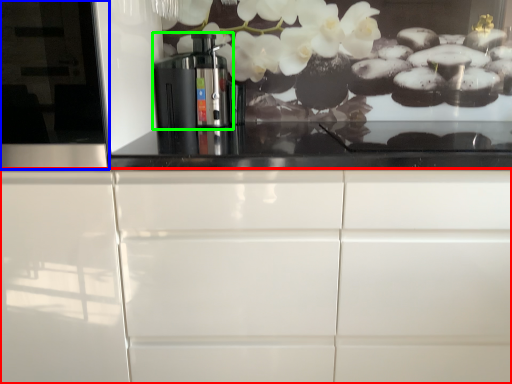
Question: Which is farther away from cabinetry (highlighted by a red box)? glass door (highlighted by a blue box) or home appliance (highlighted by a green box)?

Choices:
 (A) glass door
 (B) home appliance

Answer: (B)